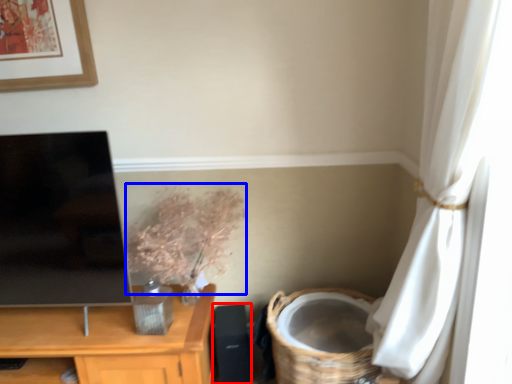
Question: Which of the following is the farthest to the observer, speaker (highlighted by a red box) or floral arrangement (highlighted by a blue box)?

Choices:
 (A) speaker
 (B) floral arrangement

Answer: (A)